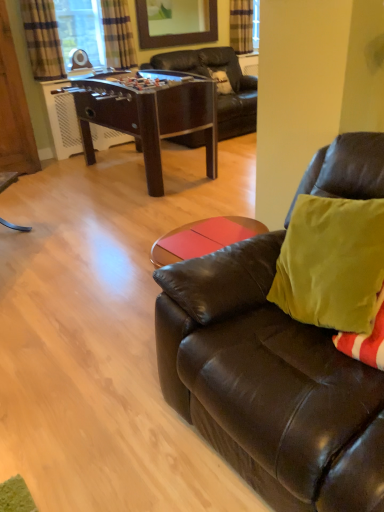
Identify the location of vacant space underneath brown wooden foosball table at center (from a real-world perspective). (142, 178).